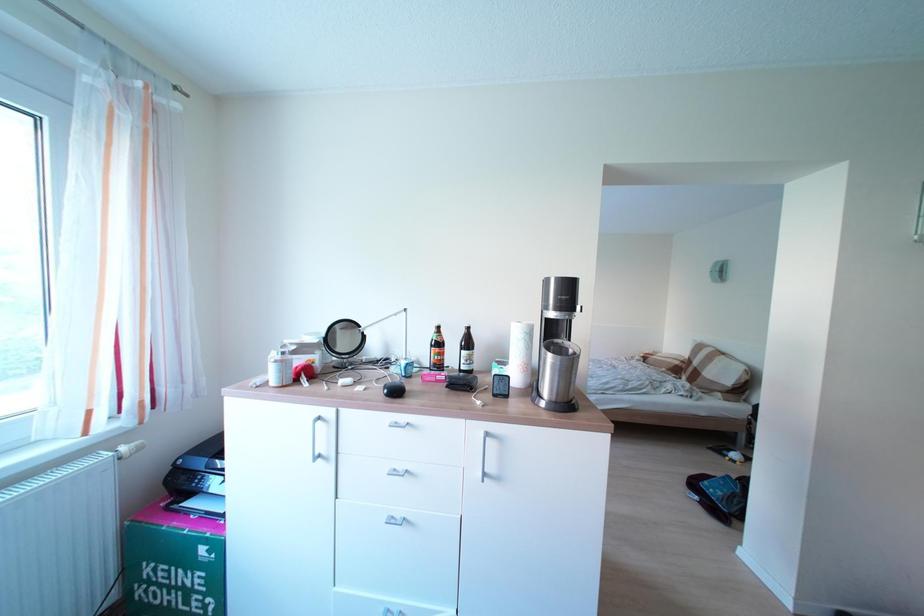
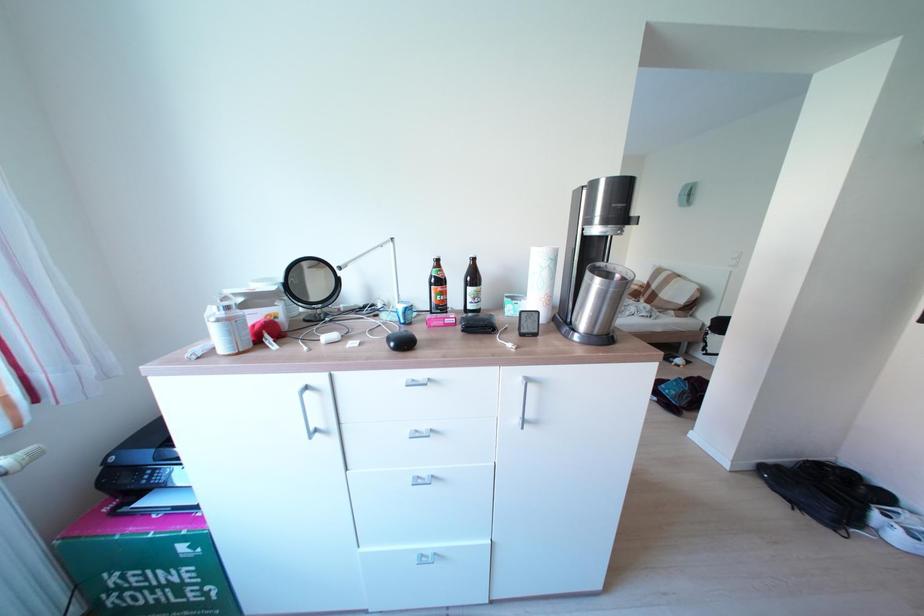
Which direction would the cameraman need to move to produce the second image?

The movement direction of the cameraman is left, forward.